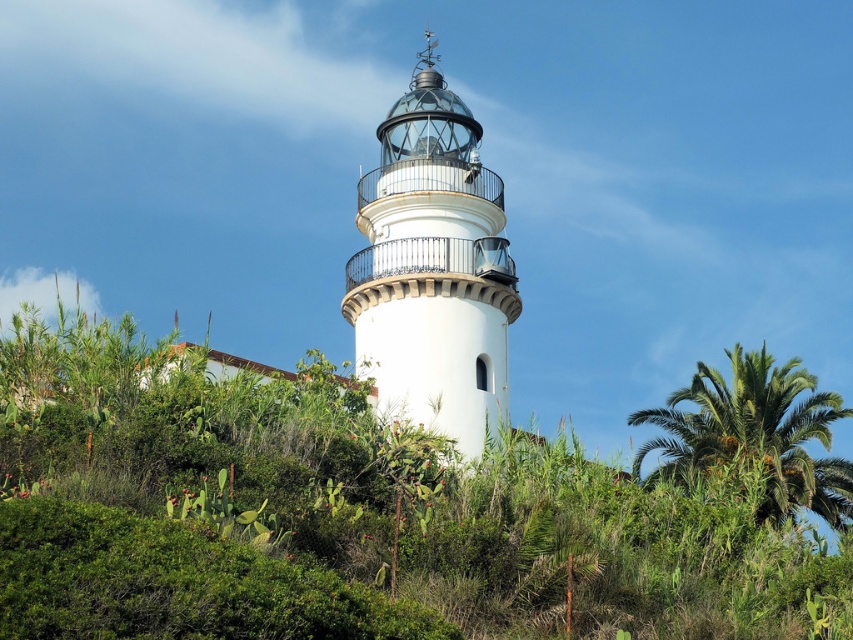
Question: Can you confirm if white matte/light tower at center is positioned to the right of green leafy palm tree at right?

Choices:
 (A) yes
 (B) no

Answer: (B)

Question: Does white matte/light tower at center have a larger size compared to green leafy palm tree at right?

Choices:
 (A) no
 (B) yes

Answer: (A)

Question: Among these objects, which one is nearest to the camera?

Choices:
 (A) white matte/light tower at center
 (B) green leafy palm tree at right

Answer: (A)

Question: Is white matte/light tower at center below green leafy palm tree at right?

Choices:
 (A) yes
 (B) no

Answer: (B)